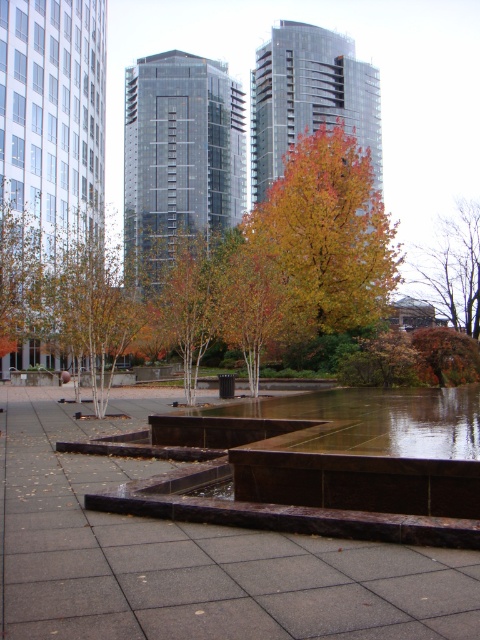
You are standing in the urban park and want to take a photo of the point at coordinates (x=37, y=426). If your camera has a maximum focus range of 15 meters, will it be able to focus on that point?

The point at coordinates (x=37, y=426) is 14.59 meters from the camera, which is within the maximum focus range of 15 meters. Therefore, the camera can focus on that point.

You are designing a garden layout and want to place a decorative stone path between the autumn leaves at center and the glossy concrete puddle at center. Which object should the path be wider than to accommodate both?

The path should be wider than the autumn leaves at center since its width is larger than the glossy concrete puddle at center.